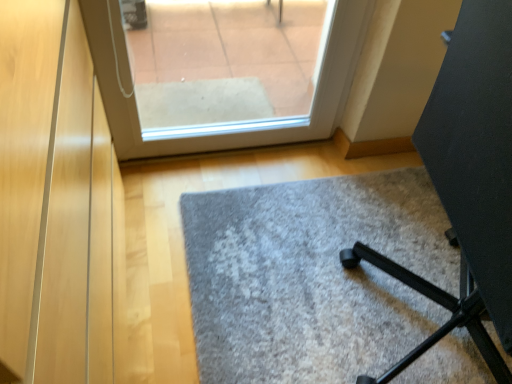
Question: Can you confirm if black matte tripod at lower right is positioned to the left of gray carpet at center?

Choices:
 (A) yes
 (B) no

Answer: (B)

Question: Are black matte tripod at lower right and gray carpet at center far apart?

Choices:
 (A) no
 (B) yes

Answer: (A)

Question: Can you confirm if black matte tripod at lower right is bigger than gray carpet at center?

Choices:
 (A) yes
 (B) no

Answer: (A)

Question: Can you confirm if black matte tripod at lower right is wider than gray carpet at center?

Choices:
 (A) no
 (B) yes

Answer: (A)

Question: Is black matte tripod at lower right positioned behind gray carpet at center?

Choices:
 (A) no
 (B) yes

Answer: (A)

Question: Is black matte tripod at lower right facing away from gray carpet at center?

Choices:
 (A) yes
 (B) no

Answer: (B)

Question: Does gray carpet at center have a lesser height compared to black matte tripod at lower right?

Choices:
 (A) yes
 (B) no

Answer: (A)

Question: Is gray carpet at center closer to camera compared to black matte tripod at lower right?

Choices:
 (A) no
 (B) yes

Answer: (A)

Question: Considering the relative sizes of gray carpet at center and black matte tripod at lower right in the image provided, is gray carpet at center wider than black matte tripod at lower right?

Choices:
 (A) yes
 (B) no

Answer: (A)

Question: Is gray carpet at center located outside black matte tripod at lower right?

Choices:
 (A) yes
 (B) no

Answer: (A)

Question: Is gray carpet at center oriented away from black matte tripod at lower right?

Choices:
 (A) no
 (B) yes

Answer: (A)

Question: From a real-world perspective, is gray carpet at center physically below black matte tripod at lower right?

Choices:
 (A) no
 (B) yes

Answer: (B)

Question: From their relative heights in the image, would you say black matte tripod at lower right is taller or shorter than gray carpet at center?

Choices:
 (A) tall
 (B) short

Answer: (A)